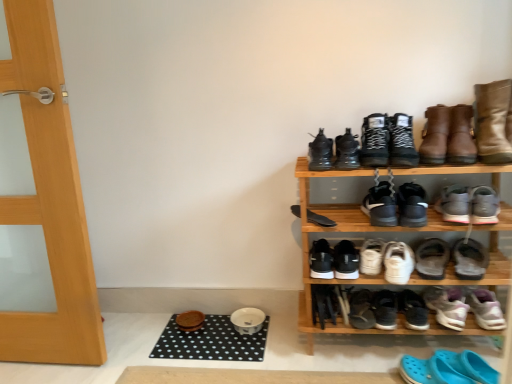
Where is `empty space that is in between wooden door at left and black rubber doormat at lower center, positioned as the first doormat in front-to-back order`? Image resolution: width=512 pixels, height=384 pixels. empty space that is in between wooden door at left and black rubber doormat at lower center, positioned as the first doormat in front-to-back order is located at coordinates (187, 363).